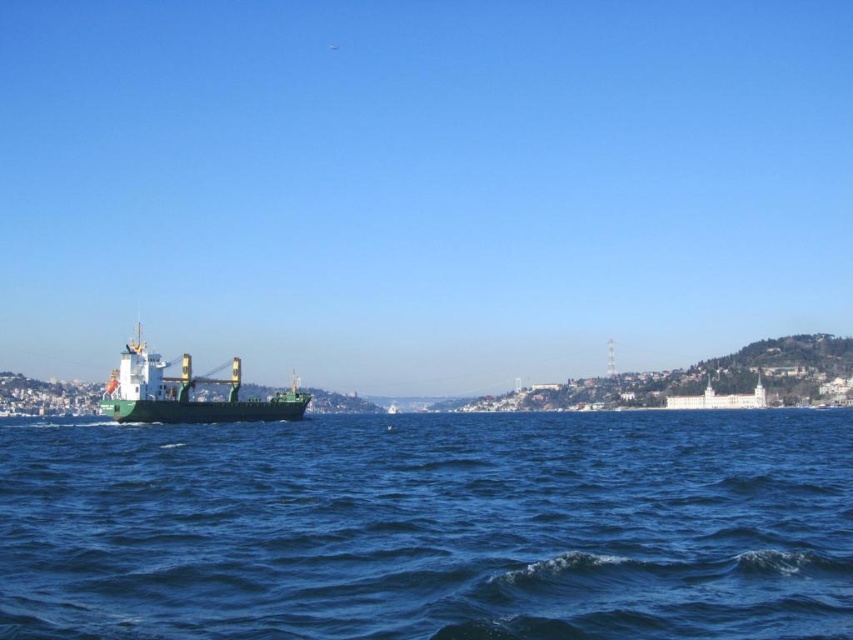
Question: Observing the image, what is the correct spatial positioning of blue water at center in reference to green matte cargo ship at center?

Choices:
 (A) below
 (B) above

Answer: (B)

Question: Can you confirm if blue water at center is positioned to the right of green matte cargo ship at center?

Choices:
 (A) yes
 (B) no

Answer: (A)

Question: Does blue water at center appear over green matte cargo ship at center?

Choices:
 (A) yes
 (B) no

Answer: (A)

Question: Among these points, which one is nearest to the camera?

Choices:
 (A) (106, 500)
 (B) (126, 372)

Answer: (A)

Question: Which object is farther from the camera taking this photo?

Choices:
 (A) green matte cargo ship at center
 (B) blue water at center

Answer: (A)